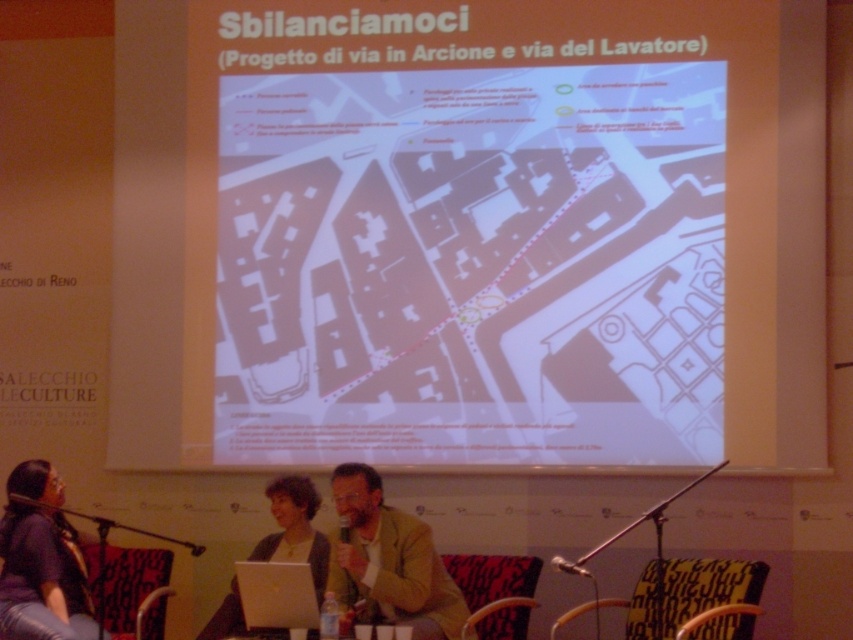
You are a stagehand responsible for setting up the microphone. The blue fabric chair at lower left is where the presenter will sit. The metallic silver microphone at lower center is currently placed 2.68 meters away from the chair. Is the microphone positioned at a comfortable distance for the presenter to speak into it without leaning too far?

The metallic silver microphone at lower center is 2.68 meters away from the blue fabric chair at lower left. A typical comfortable distance for a microphone is around 1 meter, so the current placement is too far. The presenter would need to lean forward or move closer to speak effectively into the microphone.

You are standing at the front of the room facing the presentation table. There are two points marked on the floor in front of you. The first point is at coordinates point (50, 595) and the second point is at point (343, 522). Which point is closer to the projection screen located behind the presenters?

Point (50, 595) is behind point (343, 522), so the point closer to the projection screen is point (50, 595).